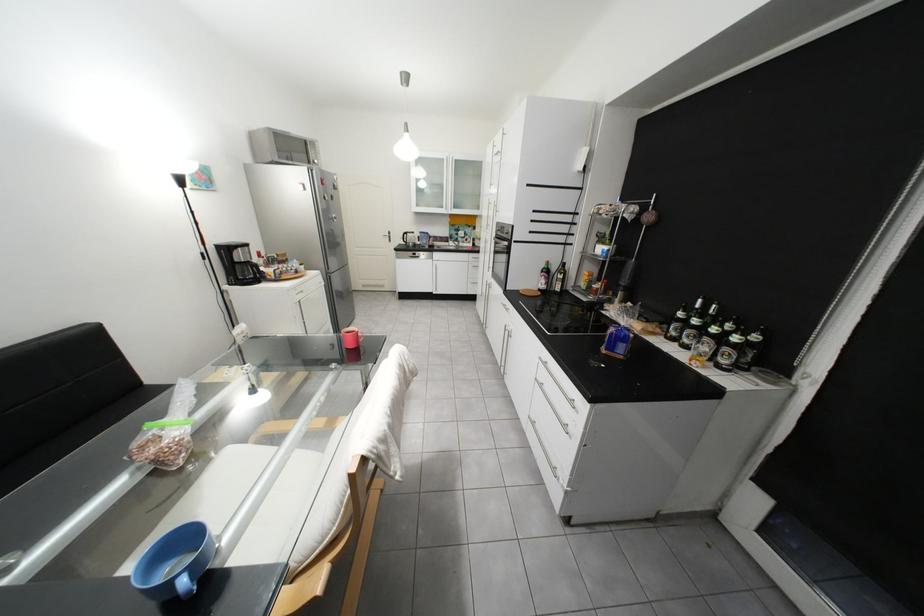
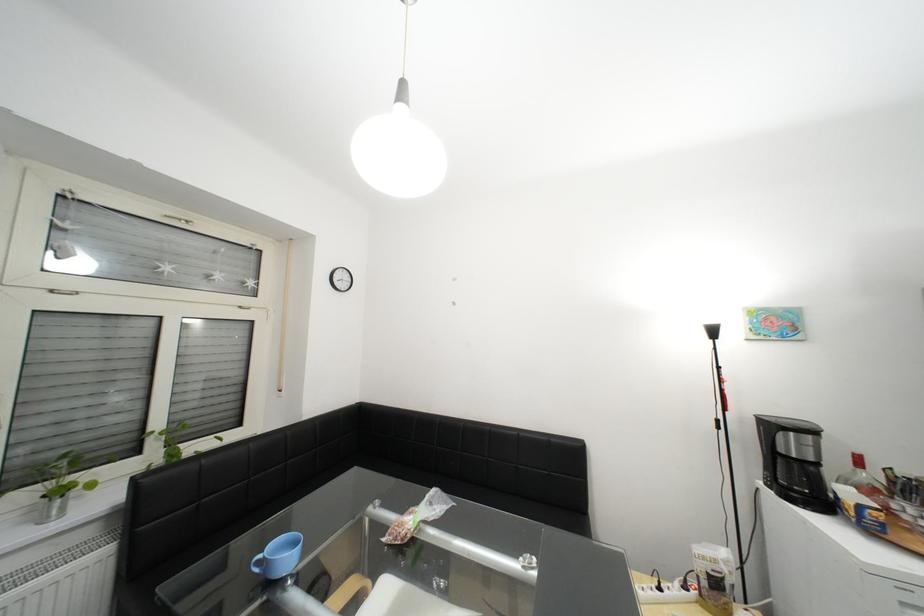
In the second image, find the point that corresponds to (278,267) in the first image.

(881, 492)